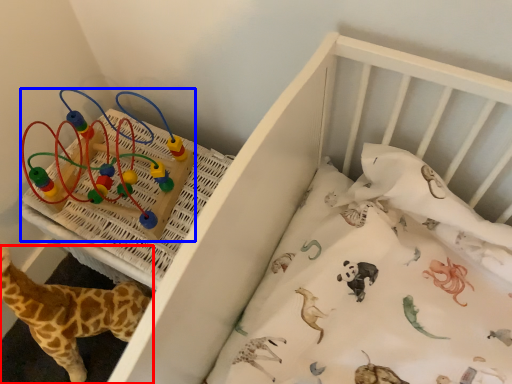
Question: Which object is further to the camera taking this photo, giraffe (highlighted by a red box) or toy (highlighted by a blue box)?

Choices:
 (A) giraffe
 (B) toy

Answer: (B)